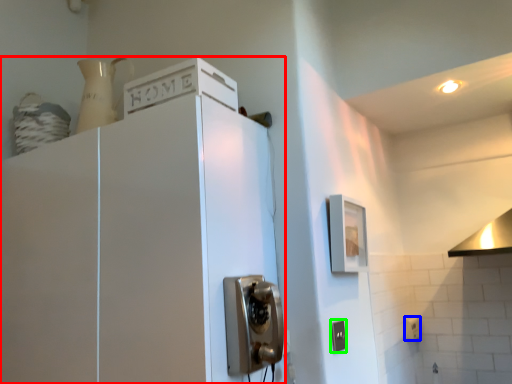
Question: Based on their relative distances, which object is farther from cabinetry (highlighted by a red box)? Choose from electric outlet (highlighted by a blue box) and electric outlet (highlighted by a green box).

Choices:
 (A) electric outlet
 (B) electric outlet

Answer: (A)